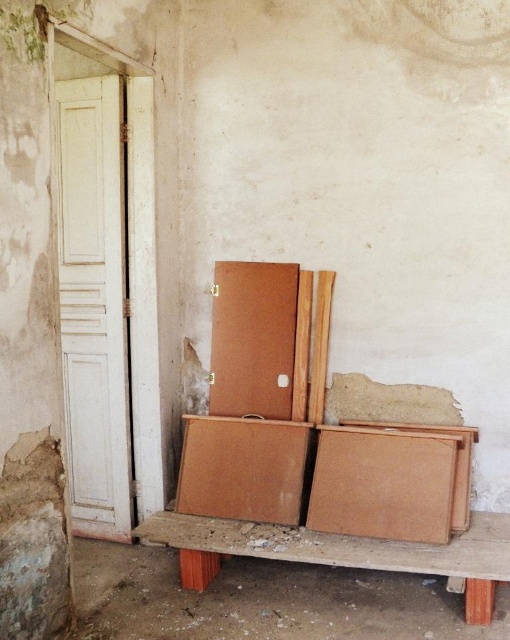
Question: Can you confirm if wooden bench at lower center is positioned above brown cardboard box at center?

Choices:
 (A) yes
 (B) no

Answer: (B)

Question: Does brown cardboard box at lower center appear on the right side of brown cardboard box at center?

Choices:
 (A) no
 (B) yes

Answer: (B)

Question: Which of the following is the farthest from the observer?

Choices:
 (A) (382, 486)
 (B) (143, 531)
 (C) (192, 490)

Answer: (C)

Question: Is wooden bench at lower center above brown cardboard box at center?

Choices:
 (A) no
 (B) yes

Answer: (A)

Question: Among these objects, which one is nearest to the camera?

Choices:
 (A) wooden bench at lower center
 (B) brown cardboard box at center

Answer: (A)

Question: Based on their relative distances, which object is farther from the wooden bench at lower center?

Choices:
 (A) brown cardboard box at center
 (B) brown cardboard box at lower center

Answer: (A)